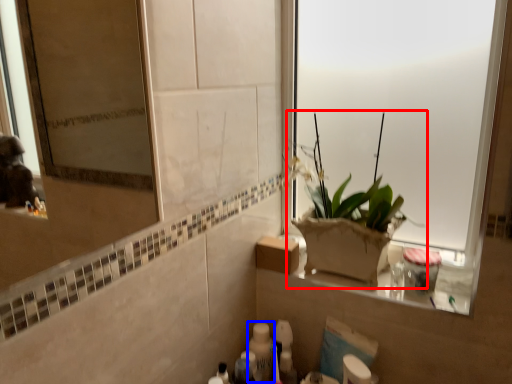
Question: Among these objects, which one is nearest to the camera, houseplant (highlighted by a red box) or toiletry (highlighted by a blue box)?

Choices:
 (A) houseplant
 (B) toiletry

Answer: (A)